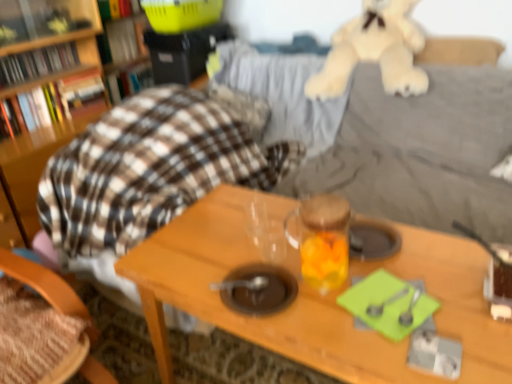
You are a GUI agent. You are given a task and a screenshot of the screen. Output one action in this format:
    pyautogui.click(x=<x>, y=<y>)
    Task: Click on the empty space that is ontop of hardcover book at upper left, positioned as the third book in top-to-bottom order (from a real-world perspective)
    
    Given the screenshot: What is the action you would take?
    pyautogui.click(x=125, y=63)